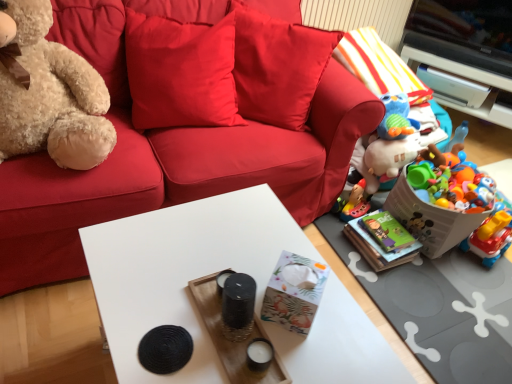
Identify the location of unoccupied region to the right of black woven coaster at lower center, marked as the 1th toy in a left-to-right arrangement. The image size is (512, 384). (236, 348).